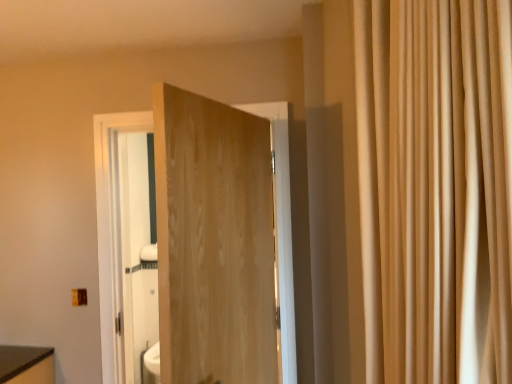
At what (x,y) coordinates should I click in order to perform the action: click on beige fabric curtain at right. Please return your answer as a coordinate pair (x, y). This screenshot has height=384, width=512. Looking at the image, I should click on (435, 188).

Describe the element at coordinates (435, 188) in the screenshot. The height and width of the screenshot is (384, 512). I see `beige fabric curtain at right` at that location.

From the picture: Measure the distance between natural wood door at center and camera.

They are 6.68 feet apart.

This screenshot has height=384, width=512. Describe the element at coordinates (109, 223) in the screenshot. I see `natural wood door at center` at that location.

The image size is (512, 384). I want to click on natural wood door at center, so click(x=109, y=223).

Identify the location of beige fabric curtain at right. The height and width of the screenshot is (384, 512). (435, 188).

Considering the relative positions of beige fabric curtain at right and natural wood door at center in the image provided, is beige fabric curtain at right to the left or to the right of natural wood door at center?

Clearly, beige fabric curtain at right is on the right of natural wood door at center in the image.

Is beige fabric curtain at right positioned in front of natural wood door at center?

Yes, the depth of beige fabric curtain at right is less than that of natural wood door at center.

Is point (366, 232) farther from viewer compared to point (290, 241)?

No, (366, 232) is closer to viewer.

From the image's perspective, which is below, beige fabric curtain at right or natural wood door at center?

natural wood door at center is shown below in the image.

From a real-world perspective, is beige fabric curtain at right under natural wood door at center?

No, from a real-world perspective, beige fabric curtain at right is not beneath natural wood door at center.

Which object is wider, beige fabric curtain at right or natural wood door at center?

beige fabric curtain at right is wider.

From their relative heights in the image, would you say beige fabric curtain at right is taller or shorter than natural wood door at center?

beige fabric curtain at right is shorter than natural wood door at center.

Can you confirm if beige fabric curtain at right is smaller than natural wood door at center?

Incorrect, beige fabric curtain at right is not smaller in size than natural wood door at center.

Choose the correct answer: Is beige fabric curtain at right inside natural wood door at center or outside it?

beige fabric curtain at right lies outside natural wood door at center.

Is there a large distance between beige fabric curtain at right and natural wood door at center?

Yes, beige fabric curtain at right and natural wood door at center are quite far apart.

Could you tell me if beige fabric curtain at right is facing natural wood door at center?

No, beige fabric curtain at right is not turned towards natural wood door at center.

At what (x,y) coordinates should I click in order to perform the action: click on door on the left of beige fabric curtain at right. Please return your answer as a coordinate pair (x, y). The height and width of the screenshot is (384, 512). Looking at the image, I should click on (109, 223).

Does natural wood door at center appear on the left side of beige fabric curtain at right?

Yes.

Is the position of natural wood door at center more distant than that of beige fabric curtain at right?

Yes, natural wood door at center is behind beige fabric curtain at right.

Does point (110, 221) appear closer or farther from the camera than point (470, 222)?

Point (110, 221).

From the image's perspective, between natural wood door at center and beige fabric curtain at right, which one is located above?

beige fabric curtain at right, from the image's perspective.

From a real-world perspective, between natural wood door at center and beige fabric curtain at right, who is vertically lower?

natural wood door at center is physically lower.

Is natural wood door at center thinner than beige fabric curtain at right?

Yes.

Is natural wood door at center taller than beige fabric curtain at right?

Yes, natural wood door at center is taller than beige fabric curtain at right.

Who is smaller, natural wood door at center or beige fabric curtain at right?

Smaller between the two is natural wood door at center.

Is beige fabric curtain at right completely or partially inside natural wood door at center?

No, natural wood door at center does not contain beige fabric curtain at right.

Is the surface of natural wood door at center in direct contact with beige fabric curtain at right?

No, natural wood door at center is not in contact with beige fabric curtain at right.

Could you tell me if natural wood door at center is facing beige fabric curtain at right?

No, natural wood door at center is not aimed at beige fabric curtain at right.

How different are the orientations of natural wood door at center and beige fabric curtain at right in degrees?

natural wood door at center and beige fabric curtain at right are facing 42.6 degrees away from each other.

How distant is natural wood door at center from beige fabric curtain at right?

natural wood door at center and beige fabric curtain at right are 4.81 feet apart.

Find the location of `door behind the beige fabric curtain at right`. door behind the beige fabric curtain at right is located at coordinates click(x=109, y=223).

You are a GUI agent. You are given a task and a screenshot of the screen. Output one action in this format:
    pyautogui.click(x=<x>, y=<y>)
    Task: Click on the door that appears below the beige fabric curtain at right (from a real-world perspective)
    This screenshot has height=384, width=512.
    Given the screenshot: What is the action you would take?
    pyautogui.click(x=109, y=223)

The width and height of the screenshot is (512, 384). There is a natural wood door at center. In order to click on curtain above it (from a real-world perspective) in this screenshot , I will do `click(435, 188)`.